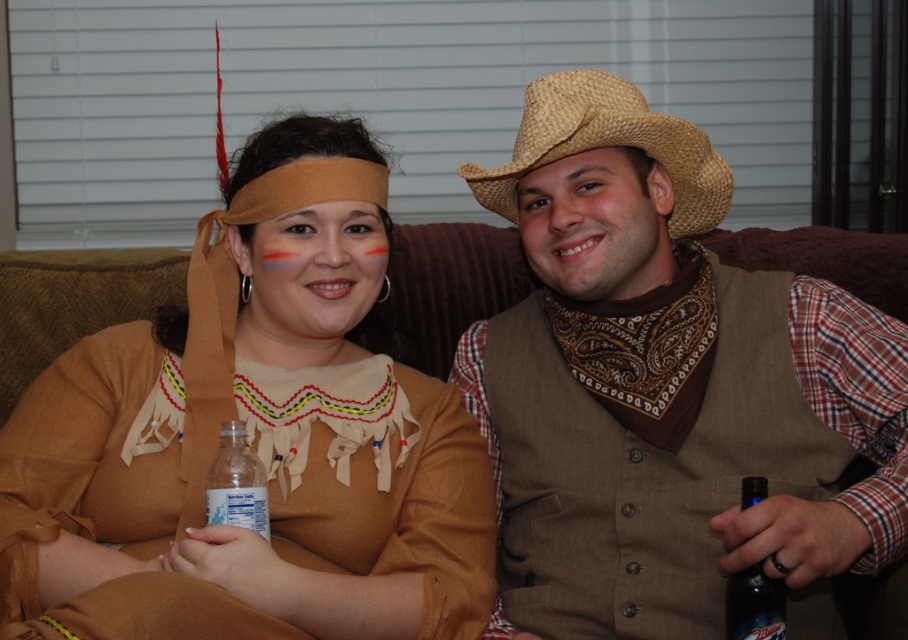
Is matte tan face at center shorter than matte straw hat at upper right?

No.

Is matte tan face at center to the left of matte straw hat at upper right from the viewer's perspective?

Yes, matte tan face at center is to the left of matte straw hat at upper right.

Is point (293, 298) positioned after point (589, 168)?

No.

Where is `matte tan face at center`? The image size is (908, 640). matte tan face at center is located at coordinates (311, 273).

Can you confirm if brown woven cowboy hat at upper right is positioned to the left of matte brown dress at center?

In fact, brown woven cowboy hat at upper right is to the right of matte brown dress at center.

Can you confirm if brown woven cowboy hat at upper right is bigger than matte brown dress at center?

A: No, brown woven cowboy hat at upper right is not bigger than matte brown dress at center.

Which is behind, point (512, 154) or point (341, 140)?

The point (512, 154) is behind.

Where is `brown woven cowboy hat at upper right`? brown woven cowboy hat at upper right is located at coordinates (666, 390).

Who is taller, brown woven cowboy hat at upper right or blue glass beer bottle at lower right?

Standing taller between the two is brown woven cowboy hat at upper right.

What do you see at coordinates (666, 390) in the screenshot? I see `brown woven cowboy hat at upper right` at bounding box center [666, 390].

Find the location of a particular element. The image size is (908, 640). brown woven cowboy hat at upper right is located at coordinates (666, 390).